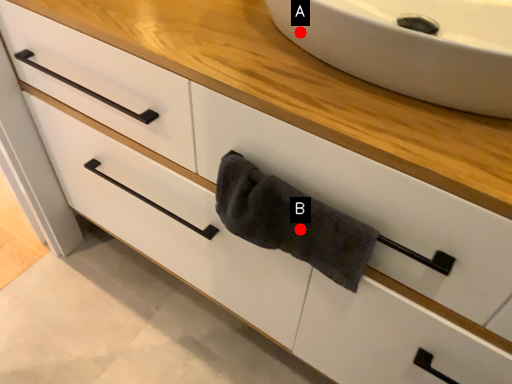
Question: Two points are circled on the image, labeled by A and B beside each circle. Among these points, which one is farthest from the camera?

Choices:
 (A) A is further
 (B) B is further

Answer: (B)